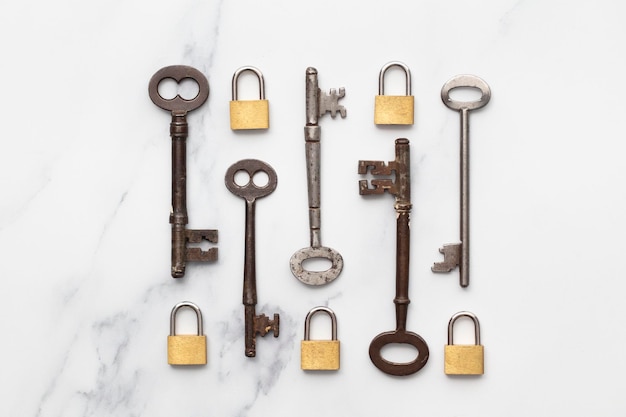
I want to click on keys, so 470,171, 390,186, 320,107, 247,179, 178,145.